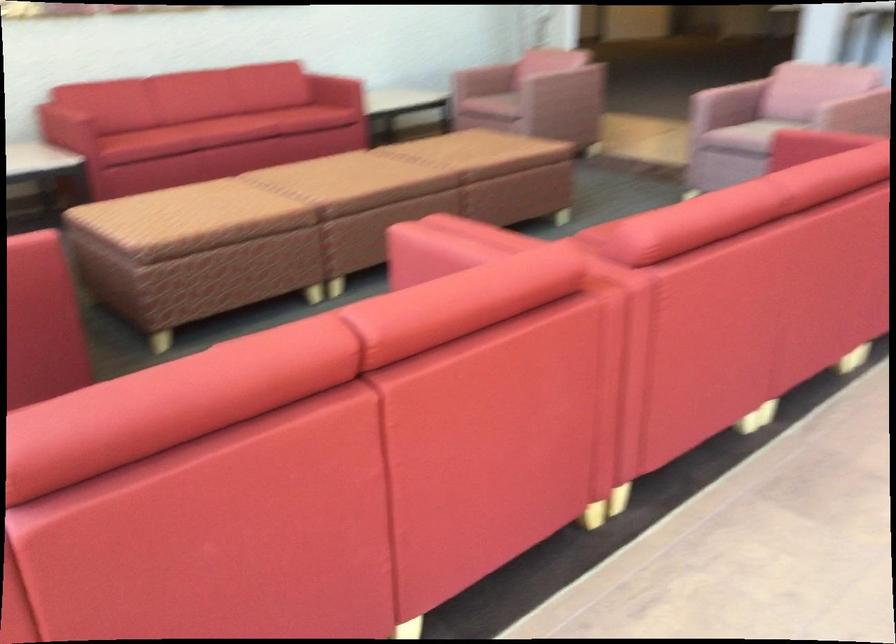
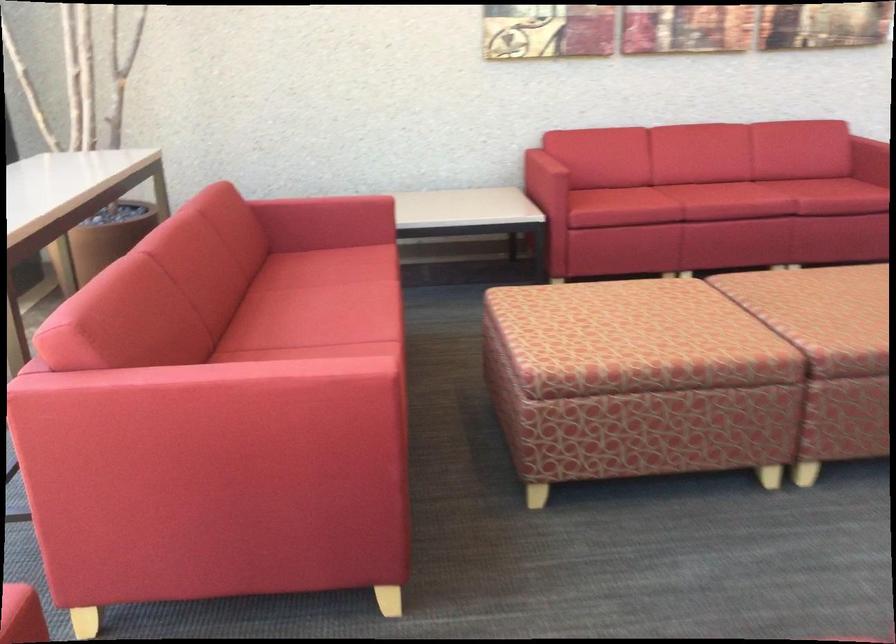
In the second image, find the point that corresponds to (x=199, y=212) in the first image.

(627, 334)